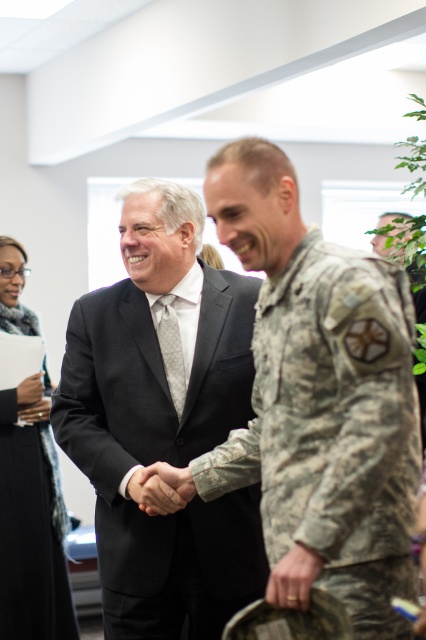
Looking at this image, you are a photographer setting up for a formal event. You need to ensure that both the black matte suit at center and the black textured coat at lower left are clearly visible in the photo. Based on their positions, which one is closer to the camera?

The black matte suit at center is in front of the black textured coat at lower left, so it is closer to the camera and will be more visible in the photo.

Where is the camouflage uniform at center located in the image?

The camouflage uniform at center is located at point (317, 401) in the image.